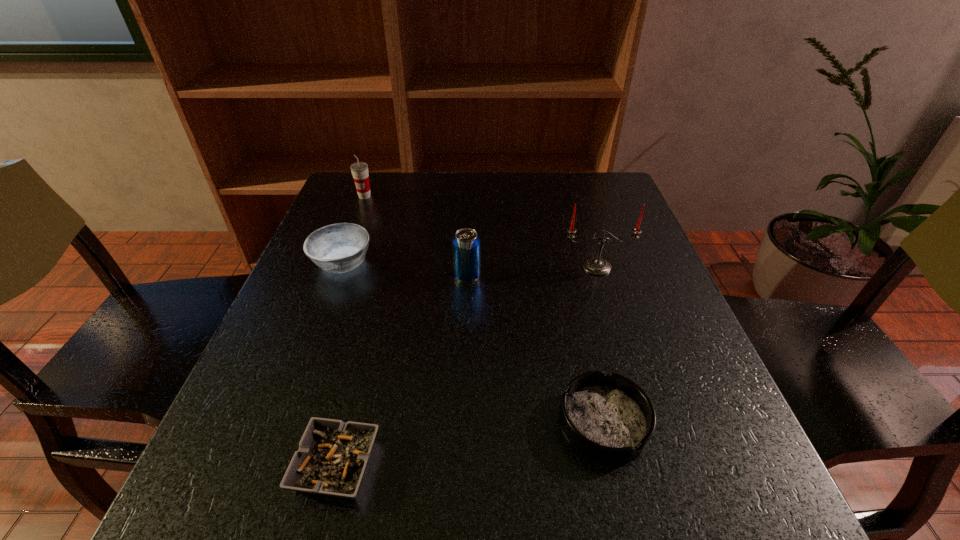
At what (x,y) coordinates should I click in order to perform the action: click on object that is at the near left corner. Please return your answer as a coordinate pair (x, y). Image resolution: width=960 pixels, height=540 pixels. Looking at the image, I should click on (332, 456).

The width and height of the screenshot is (960, 540). What are the coordinates of `free space at the far edge of the desktop` in the screenshot? It's located at (565, 202).

Find the location of a particular element. vacant space at the near edge of the desktop is located at coordinates (618, 519).

Locate an element on the screen. Image resolution: width=960 pixels, height=540 pixels. vacant space at the left edge of the desktop is located at coordinates (211, 463).

Where is `vacant space at the right edge`? The height and width of the screenshot is (540, 960). vacant space at the right edge is located at coordinates (613, 223).

Where is `vacant space at the far right corner`? vacant space at the far right corner is located at coordinates (592, 174).

The height and width of the screenshot is (540, 960). Find the location of `free area in between the beer can and the shortest object`. free area in between the beer can and the shortest object is located at coordinates (402, 370).

At what (x,y) coordinates should I click in order to perform the action: click on vacant space that's between the third shortest object and the fifth tallest object. Please return your answer as a coordinate pair (x, y). This screenshot has height=540, width=960. Looking at the image, I should click on (473, 342).

Where is `vacant region between the second shortest ashtray and the beer can`? The height and width of the screenshot is (540, 960). vacant region between the second shortest ashtray and the beer can is located at coordinates (536, 349).

Where is `vacant point located between the shortest object and the second tallest ashtray`? The width and height of the screenshot is (960, 540). vacant point located between the shortest object and the second tallest ashtray is located at coordinates (470, 443).